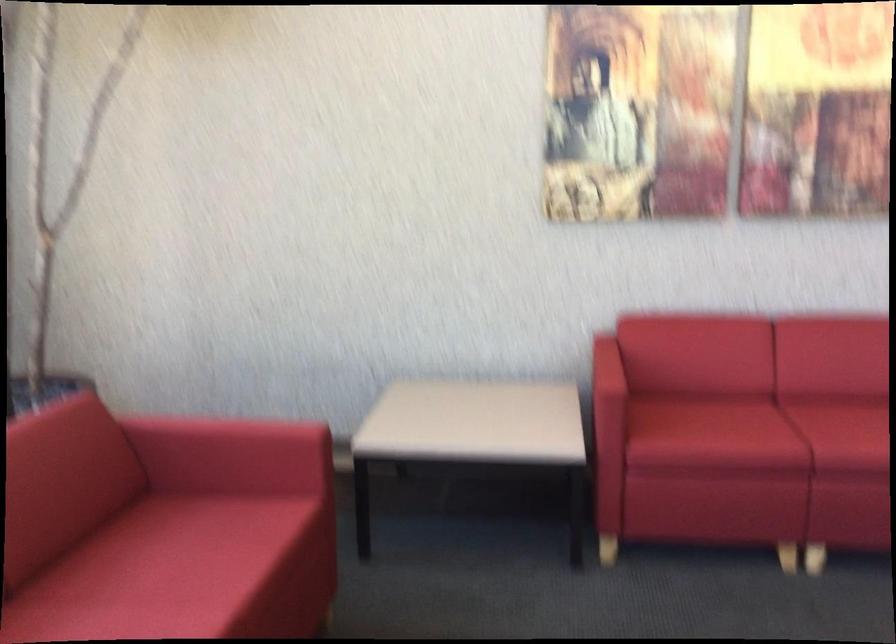
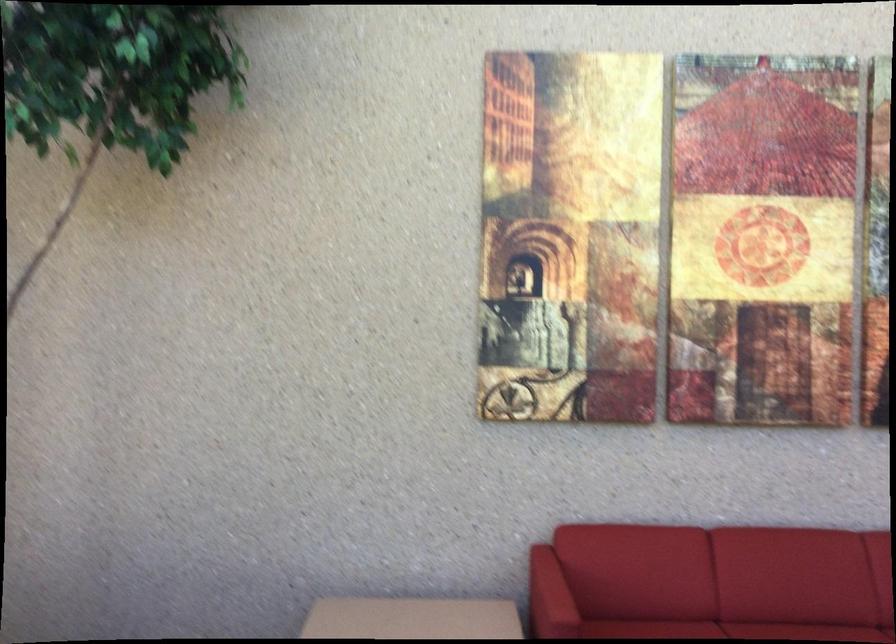
Where in the second image is the point corresponding to point 607,375 from the first image?

(549, 597)